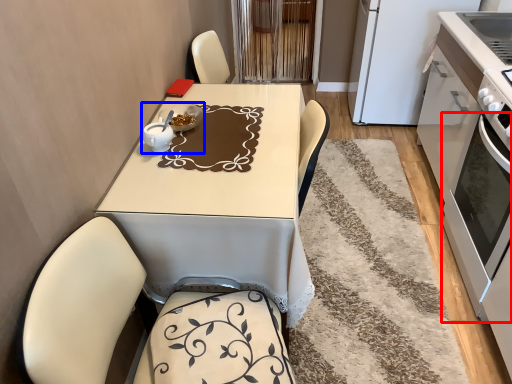
Question: Which of the following is the closest to the observer, oven (highlighted by a red box) or tableware (highlighted by a blue box)?

Choices:
 (A) oven
 (B) tableware

Answer: (A)